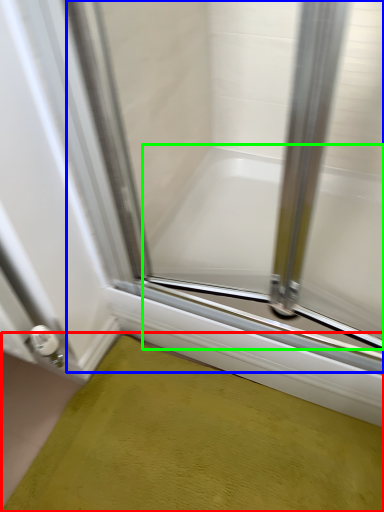
Question: Which object is positioned farthest from bath mat (highlighted by a red box)? Select from glass door (highlighted by a blue box) and bathtub (highlighted by a green box).

Choices:
 (A) glass door
 (B) bathtub

Answer: (A)